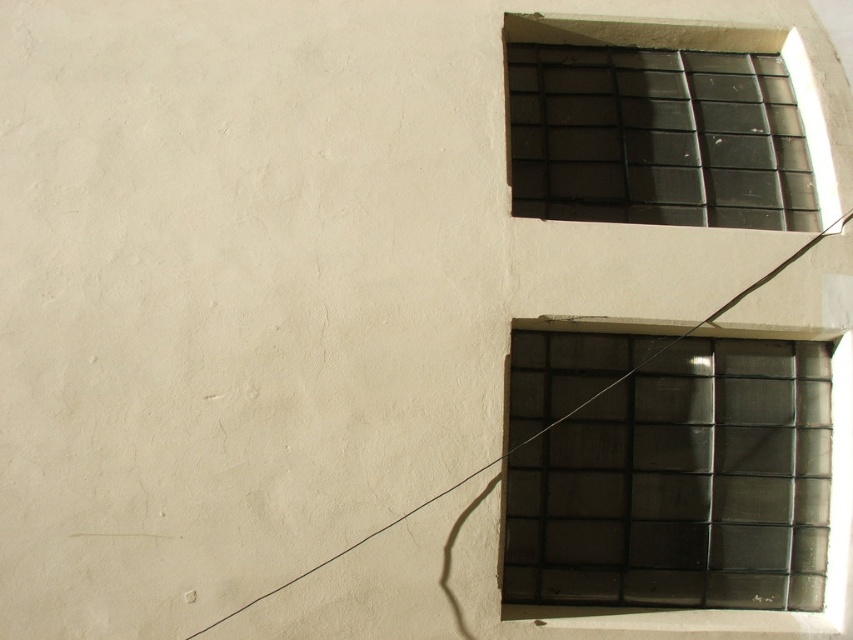
Question: Can you confirm if transparent glass window at upper right is positioned to the right of black glass window at upper right?

Choices:
 (A) yes
 (B) no

Answer: (B)

Question: Which of the following is the farthest from the observer?

Choices:
 (A) transparent glass window at upper right
 (B) black glass window at upper right

Answer: (B)

Question: Is transparent glass window at upper right bigger than black glass window at upper right?

Choices:
 (A) no
 (B) yes

Answer: (A)

Question: Where is transparent glass window at upper right located in relation to black glass window at upper right in the image?

Choices:
 (A) right
 (B) left

Answer: (B)